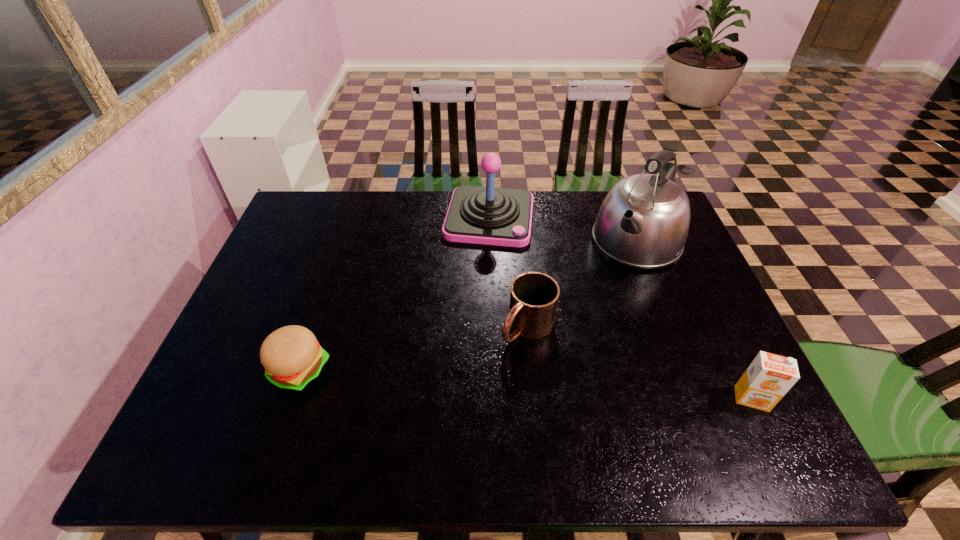
I want to click on hamburger, so click(x=292, y=357).

At what (x,y) coordinates should I click in order to perform the action: click on orange juice. Please return your answer as a coordinate pair (x, y). The height and width of the screenshot is (540, 960). Looking at the image, I should click on (769, 377).

This screenshot has height=540, width=960. What are the coordinates of `the tallest object` in the screenshot? It's located at (643, 222).

This screenshot has width=960, height=540. Identify the location of the second tallest object. (488, 215).

Identify the location of mug. (534, 296).

In order to click on blank area located on the back of the hamburger in this screenshot , I will do `click(334, 269)`.

Where is `free space located on the left of the orange juice`? The height and width of the screenshot is (540, 960). free space located on the left of the orange juice is located at coordinates click(556, 399).

The width and height of the screenshot is (960, 540). In order to click on free space located on the spout of the tallest object in this screenshot , I will do [571, 333].

Find the location of a particular element. free space located on the spout of the tallest object is located at coordinates (552, 359).

This screenshot has height=540, width=960. In order to click on vacant space located 0.210m on the spout of the tallest object in this screenshot , I will do `click(586, 313)`.